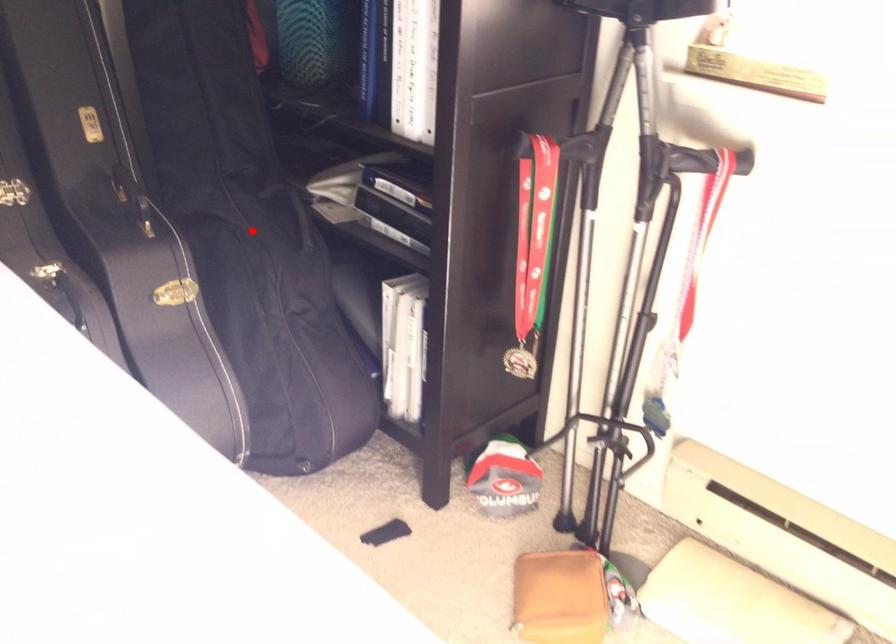
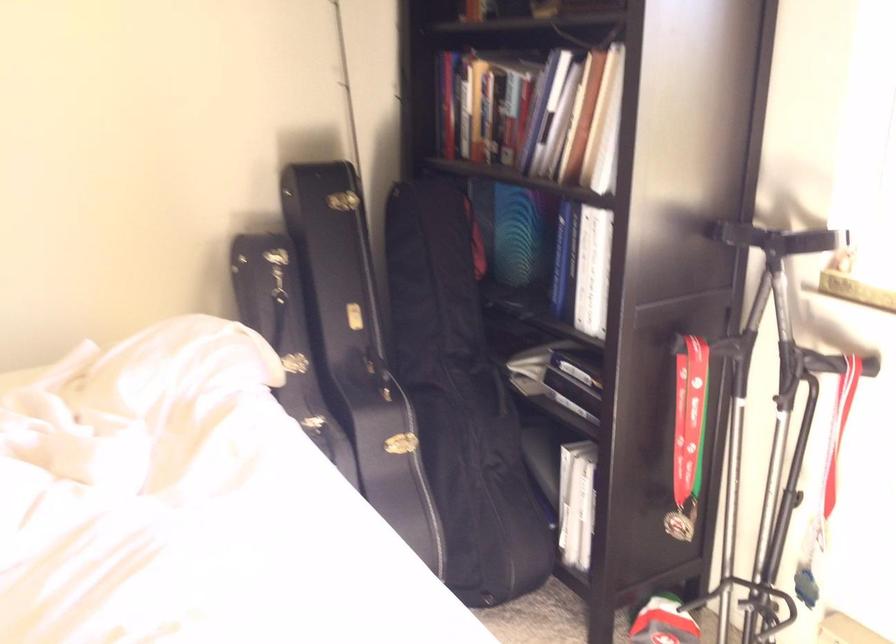
Find the pixel in the second image that matches the highlighted location in the first image.

(460, 399)